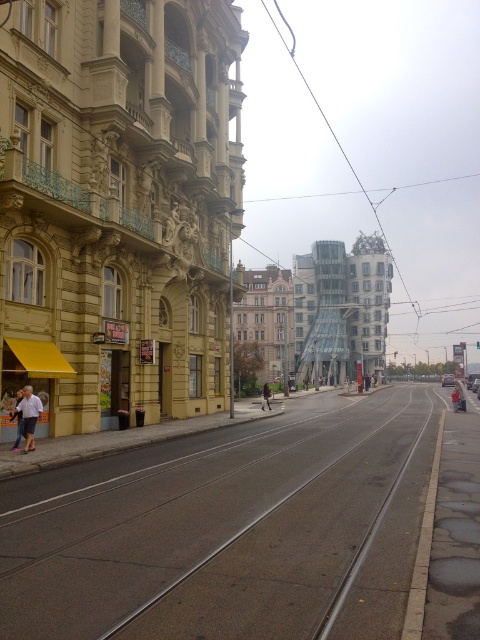
You are a pedestrian standing on the tram tracks in the center of the street. You see a white shirt at left represented by point (26, 417). In which direction should you walk to avoid the tram approaching from the right?

The white shirt at left is located at point (26, 417), so you should walk towards the left to avoid the tram approaching from the right.

You are standing on the tram tracks in the center of the street. There are two points marked on the image, point 1 at coordinates point [108,556] and point 2 at coordinates point [456,392]. Which point is closer to you?

Point [108,556] is closer to the viewer than point [456,392].